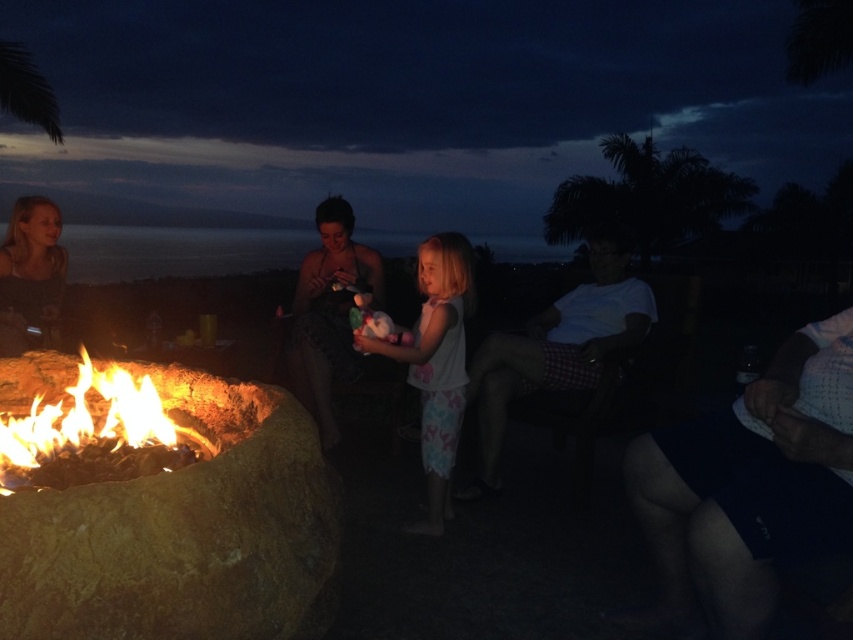
Question: Which point appears closest to the camera in this image?

Choices:
 (A) (30, 282)
 (B) (492, 353)

Answer: (B)

Question: Which object is farther from the camera taking this photo?

Choices:
 (A) flaming wood fire at lower left
 (B) white cotton dress at center
 (C) blonde hair at upper left

Answer: (C)

Question: Can you confirm if rustic stone fire pit at lower left is bigger than white cotton shirt at right?

Choices:
 (A) yes
 (B) no

Answer: (A)

Question: Can you confirm if white cotton dress at center is positioned to the right of matte black dress at center?

Choices:
 (A) yes
 (B) no

Answer: (A)

Question: Which point is farther to the camera?

Choices:
 (A) white cotton shirt at right
 (B) white cotton dress at center
 (C) rustic stone fire pit at lower left
 (D) flaming wood fire at lower left

Answer: (A)

Question: Is matte black dress at center below blonde hair at upper left?

Choices:
 (A) yes
 (B) no

Answer: (A)